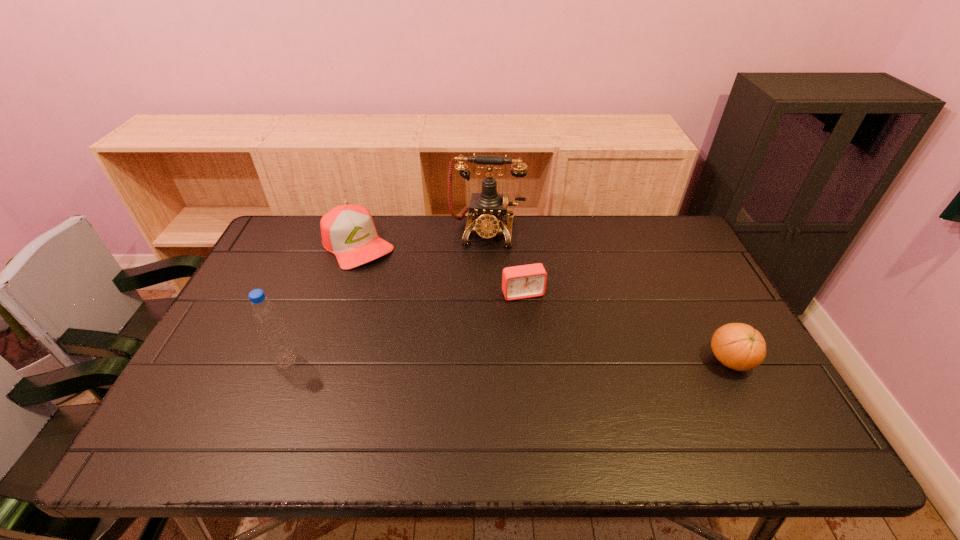
This screenshot has width=960, height=540. In order to click on free spot on the desktop that is between the second tallest object and the rightmost object and is positioned on the front-facing side of the baseball cap in this screenshot , I will do (x=466, y=361).

Image resolution: width=960 pixels, height=540 pixels. I want to click on free space on the desktop that is between the second tallest object and the orange and is positioned on the front-facing side of the shortest object, so click(x=549, y=361).

Image resolution: width=960 pixels, height=540 pixels. In order to click on free spot on the desktop that is between the water bottle and the rightmost object and is positioned on the front of the tallest object, featuring the rotary dial in this screenshot , I will do `click(468, 361)`.